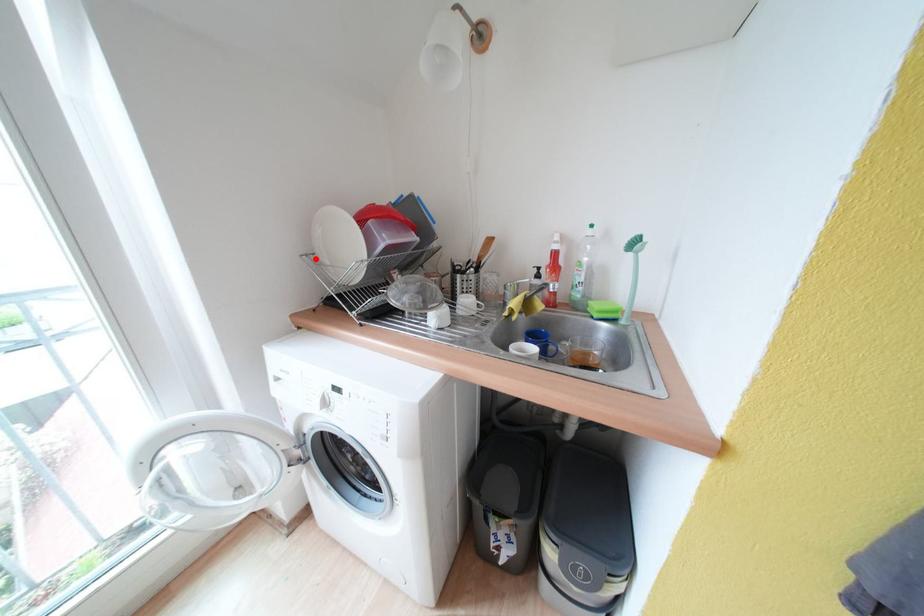
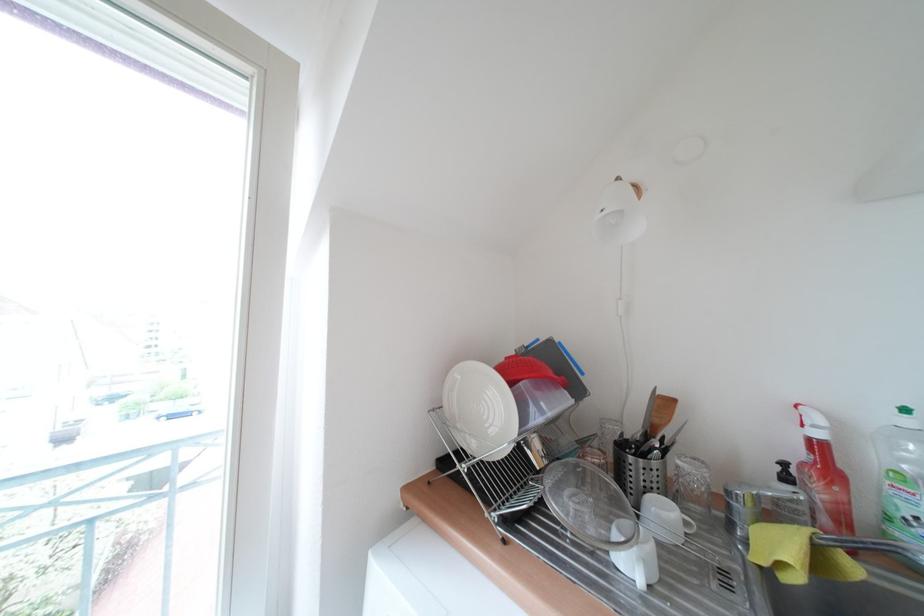
In the second image, find the point that corresponds to the highlighted location in the first image.

(444, 413)